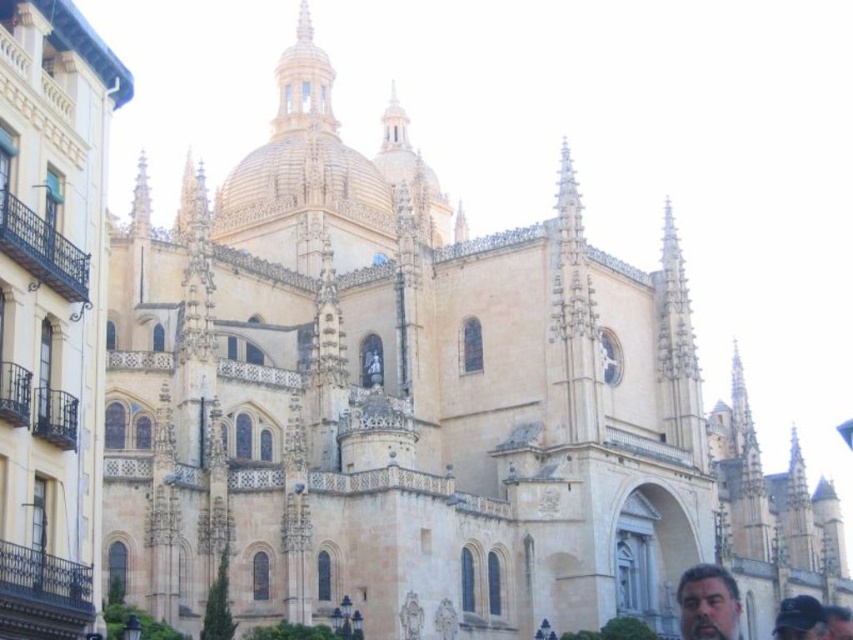
You are a photographer standing in front of the cathedral. You want to capture a photo that includes both the dark brown hair at lower right and the dark brown leather cap at lower right. Which object should you zoom in on to ensure both are clearly visible in the frame?

The dark brown hair at lower right has a smaller size compared to the dark brown leather cap at lower right. To ensure both are clearly visible, you should zoom in on the dark brown leather cap at lower right since it is larger and will remain in focus while the smaller dark brown hair at lower right will also be captured within the frame.

You are a tourist standing at the entrance of the cathedral and notice two caps on the ground near the right side. Which cap can you see more of, the dark blue fabric cap at lower right or the dark brown leather cap at lower right?

The dark blue fabric cap at lower right is in front of the dark brown leather cap at lower right, so you can see more of the dark blue fabric cap at lower right.

You are standing in front of the cathedral and notice two items at the lower right corner of the image. Which one is closer to you between the dark brown hair at lower right and the dark brown leather cap at lower right?

The dark brown hair at lower right is closer to the viewer than the dark brown leather cap at lower right.